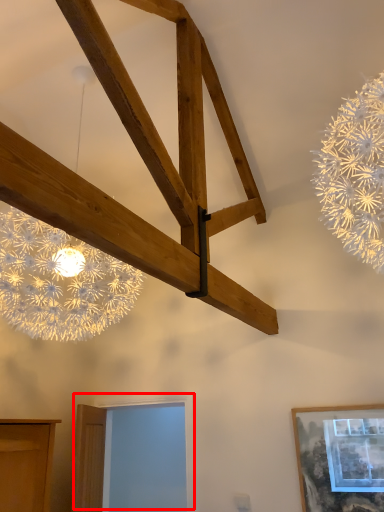
Question: Observing the image, what is the correct spatial positioning of window (annotated by the red box) in reference to picture frame?

Choices:
 (A) right
 (B) left

Answer: (B)